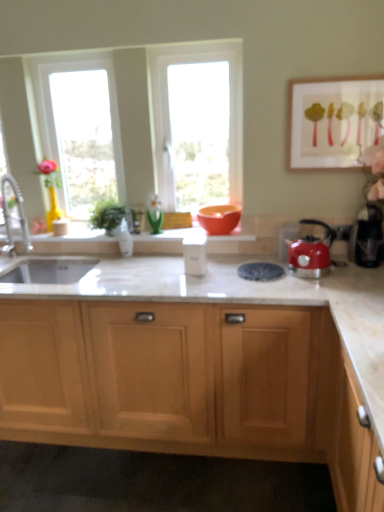
Where is `vacant space to the left of white glossy container at center`? This screenshot has width=384, height=512. vacant space to the left of white glossy container at center is located at coordinates (157, 274).